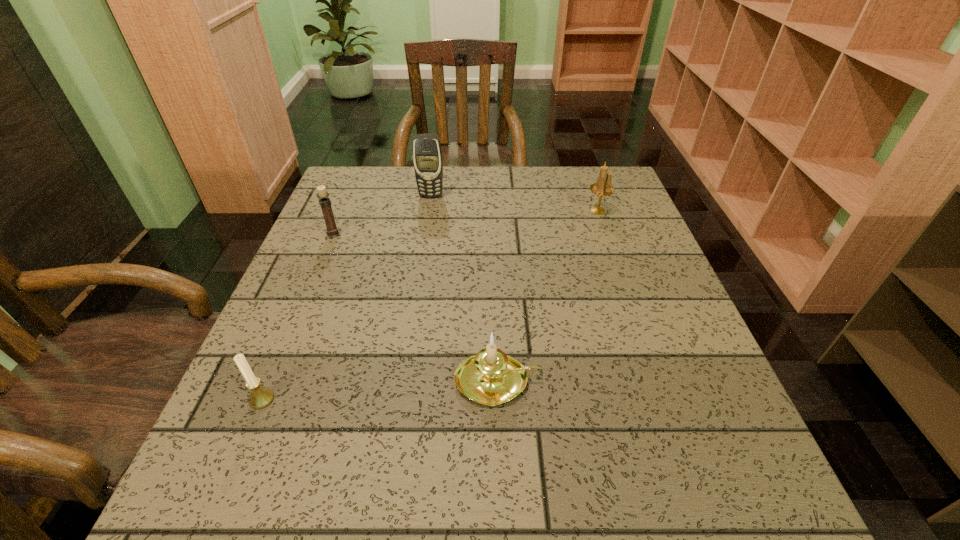
Locate an element on the screen. The height and width of the screenshot is (540, 960). the second closest candle holder to the second farthest object is located at coordinates (322, 195).

Image resolution: width=960 pixels, height=540 pixels. Find the location of `vacant space that satisfies the following two spatial constraints: 1. on the front face of the tallest object; 2. on the right side of the second farthest object`. vacant space that satisfies the following two spatial constraints: 1. on the front face of the tallest object; 2. on the right side of the second farthest object is located at coordinates (429, 211).

Locate an element on the screen. This screenshot has height=540, width=960. vacant space that satisfies the following two spatial constraints: 1. on the front face of the farthest candle holder; 2. on the left side of the tallest object is located at coordinates (429, 211).

This screenshot has width=960, height=540. I want to click on free location that satisfies the following two spatial constraints: 1. on the front face of the second farthest object; 2. on the right side of the farthest object, so click(x=429, y=211).